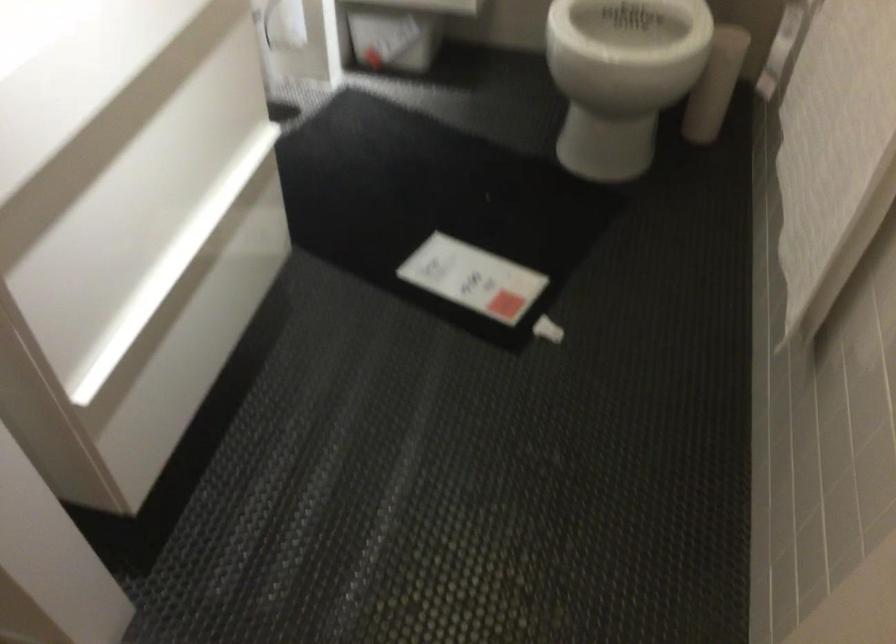
Which object does [428,196] point to?

It corresponds to the black floor mat in the image.